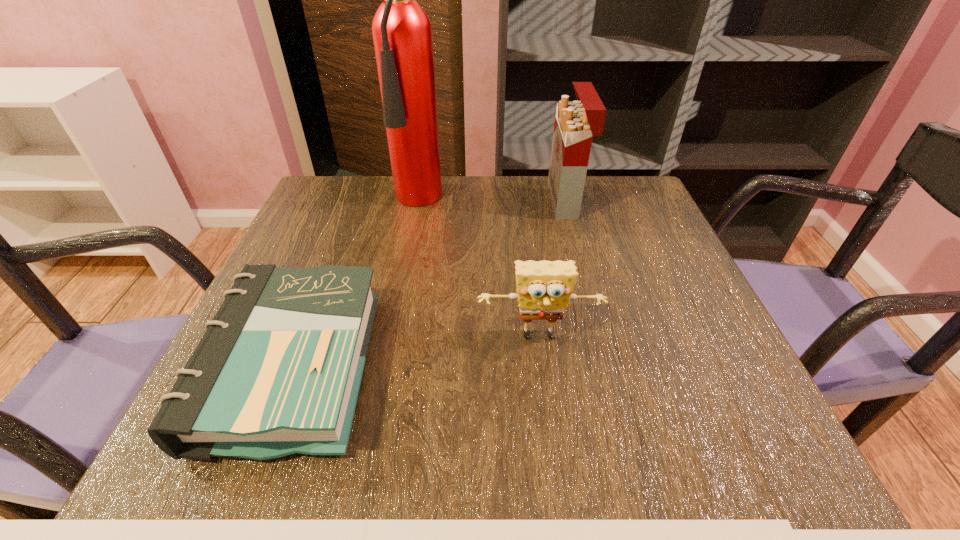
Identify the location of free space that is in between the sponge and the tallest object. (486, 269).

Identify the location of empty space that is in between the paperback book and the third tallest object. (416, 353).

Identify the location of vacant area that lies between the shortest object and the sponge. This screenshot has height=540, width=960. (416, 353).

Where is `vacant area that lies between the third shortest object and the paperback book`? This screenshot has height=540, width=960. vacant area that lies between the third shortest object and the paperback book is located at coordinates (429, 285).

You are a GUI agent. You are given a task and a screenshot of the screen. Output one action in this format:
    pyautogui.click(x=<x>, y=<y>)
    Task: Click on the free point between the sponge and the tallest object
    This screenshot has height=540, width=960.
    Given the screenshot: What is the action you would take?
    pyautogui.click(x=486, y=269)

The width and height of the screenshot is (960, 540). In order to click on unoccupied area between the tallest object and the cigarette case in this screenshot , I will do `click(499, 200)`.

Locate an element on the screen. The height and width of the screenshot is (540, 960). the third closest object to the sponge is located at coordinates (402, 34).

Identify the location of object that can be found as the closest to the tallest object. (576, 122).

I want to click on vacant position in the image that satisfies the following two spatial constraints: 1. with the lid open on the cigarette case; 2. on the face of the sponge, so click(602, 338).